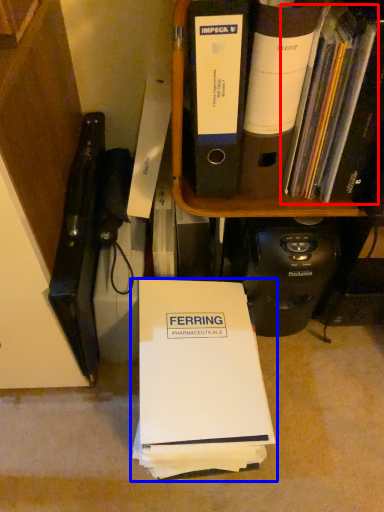
Question: Which point is further to the camera, book (highlighted by a red box) or book (highlighted by a blue box)?

Choices:
 (A) book
 (B) book

Answer: (B)